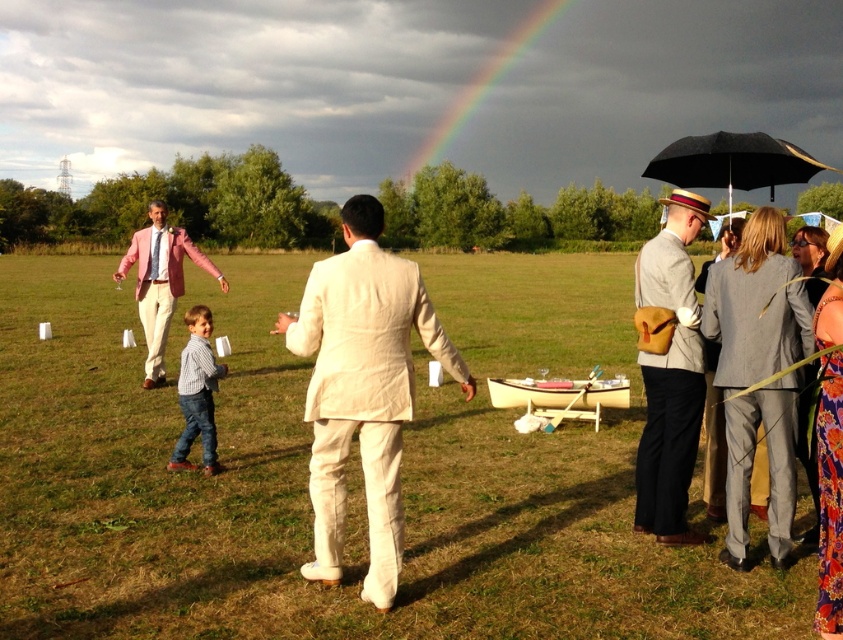
Based on the photo, who is taller, light gray wool suit at right or rainbow at upper center?

Standing taller between the two is rainbow at upper center.

Does light gray wool suit at right appear on the right side of rainbow at upper center?

In fact, light gray wool suit at right is to the left of rainbow at upper center.

Identify the location of light gray wool suit at right. (670, 376).

Which of these two, light gray wool suit at right or pink linen suit at left, stands shorter?

light gray wool suit at right

Is point (691, 429) positioned in front of point (159, 214)?

Yes.

Where is `light gray wool suit at right`? light gray wool suit at right is located at coordinates (670, 376).

Locate an element on the screen. light gray wool suit at right is located at coordinates (670, 376).

Can you confirm if light beige suit at center is positioned above beige linen suit at center?

Yes.

Looking at this image, who is lower down, light beige suit at center or beige linen suit at center?

beige linen suit at center is below.

Is point (341, 609) closer to camera compared to point (380, 413)?

That is False.

Where is `light beige suit at center`? This screenshot has height=640, width=843. light beige suit at center is located at coordinates (347, 474).